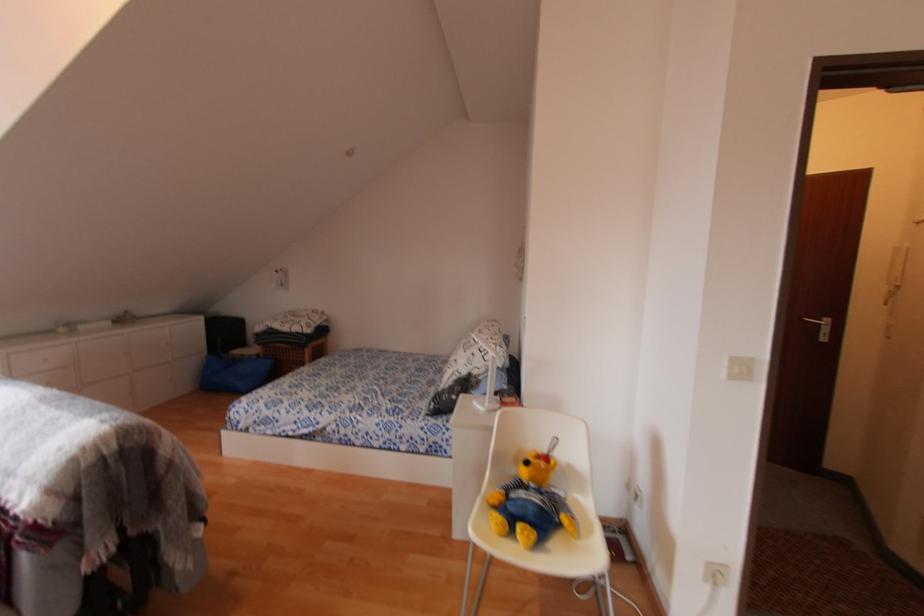
Where would you lift the blue tote bag? Please return your answer as a coordinate pair (x, y).

(235, 373)